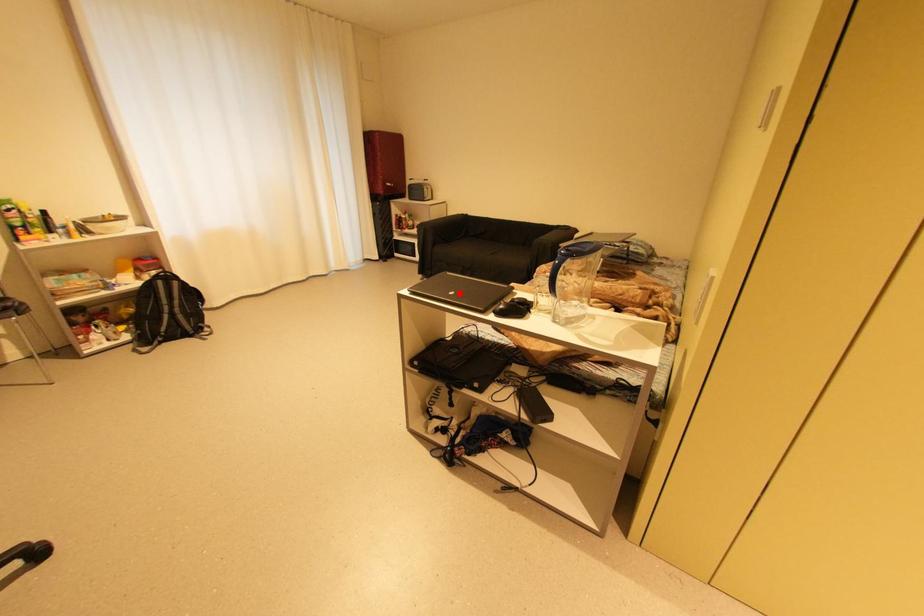
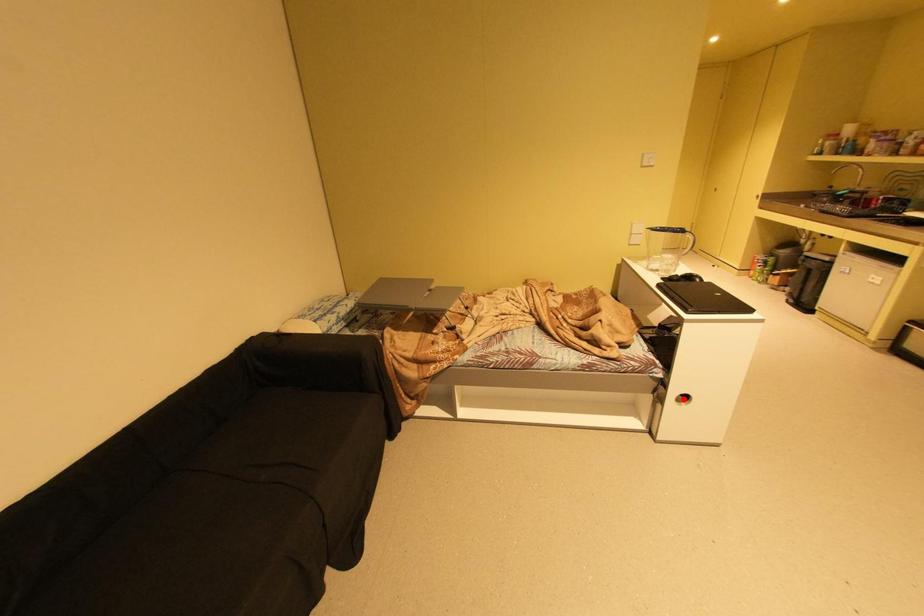
I am providing you with two images of the same scene from different viewpoints. A red point is marked on the first image and another point is marked on the second image. Is the red point in image1 aligned with the point shown in image2?

No